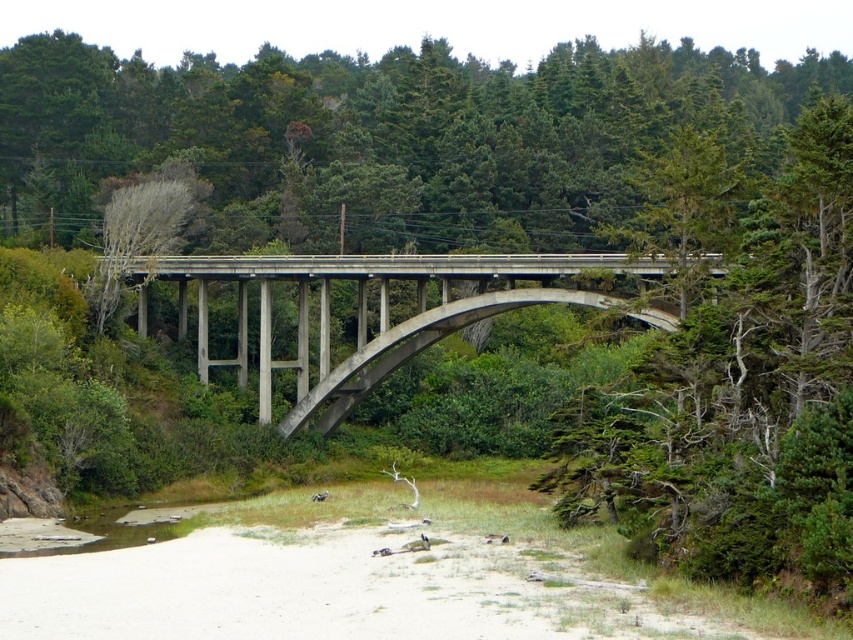
You are a landscape architect evaluating the image. You need to determine if the concrete bridge at center can support a new pathway that will be twice as wide as the brown sedimentary river at lower left. Based on the size comparison provided, can the bridge accommodate this pathway?

The concrete bridge at center has a larger size compared to the brown sedimentary river at lower left. Since the bridge is larger, it can accommodate a pathway twice as wide as the river.

You are standing at the coordinates point 0.5, 0.5 in the image. Can you see the concrete bridge at center from your current position?

Yes, the concrete bridge at center is located at point (383, 308), which is very close to your current position at (426, 320). You can see it clearly from there.